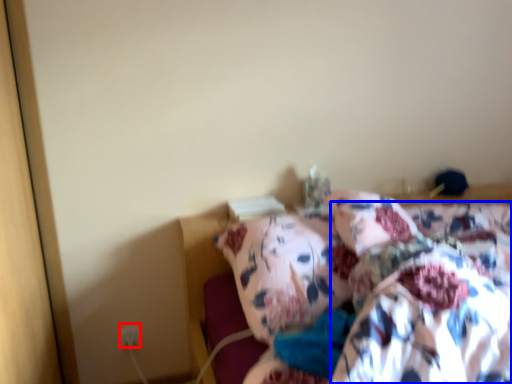
Question: Which object appears closest to the camera in this image, electric outlet (highlighted by a red box) or blanket (highlighted by a blue box)?

Choices:
 (A) electric outlet
 (B) blanket

Answer: (B)